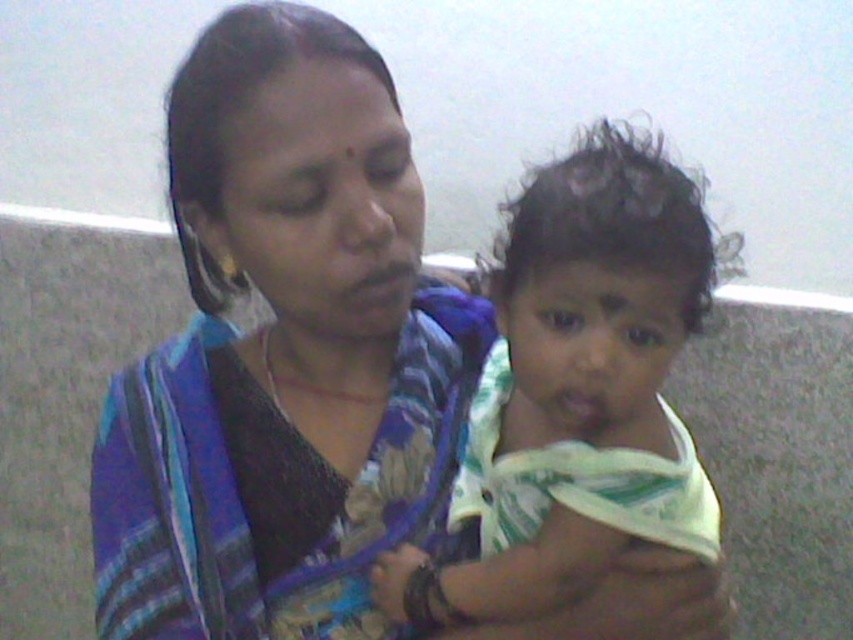
You are a photographer setting up a shoot in this indoor scene. You need to position a light source to the right of the white cotton cloth at center so that it illuminates the blue striped sari at center. Is this possible given their positions?

The blue striped sari at center is to the left of the white cotton cloth at center. Positioning the light source to the right of the white cotton cloth at center would place it further to the right of the blue striped sari at center, so yes, the light can be placed there to illuminate the blue striped sari at center.

You are an interior designer planning to place a decorative item between the blue striped sari at center and the white cotton cloth at center. To ensure it fits, you need to know which one is wider. Which object is wider?

The blue striped sari at center might be wider than white cotton cloth at center, so it is possible that the blue striped sari at center is wider.